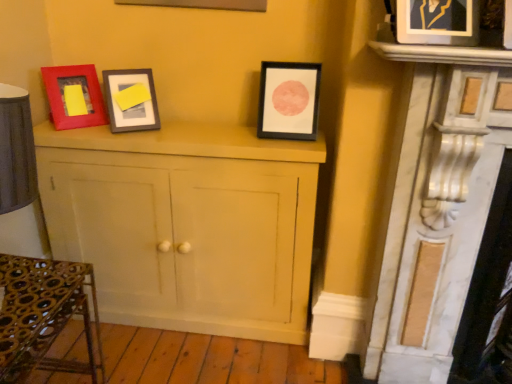
Question: From the image's perspective, is black matte picture frame at center, marked as the 2th picture frame in a front-to-back arrangement, located beneath metallic gold picture frame at upper right, positioned as the first picture frame in front-to-back order?

Choices:
 (A) no
 (B) yes

Answer: (B)

Question: Can you confirm if black matte picture frame at center, marked as the 2th picture frame in a front-to-back arrangement, is smaller than metallic gold picture frame at upper right, which ranks as the second picture frame in back-to-front order?

Choices:
 (A) no
 (B) yes

Answer: (A)

Question: Considering the relative sizes of black matte picture frame at center, marked as the 2th picture frame in a front-to-back arrangement, and metallic gold picture frame at upper right, which is the 2th picture frame from left to right, in the image provided, is black matte picture frame at center, marked as the 2th picture frame in a front-to-back arrangement, bigger than metallic gold picture frame at upper right, which is the 2th picture frame from left to right,?

Choices:
 (A) no
 (B) yes

Answer: (B)

Question: Is the position of black matte picture frame at center, the second picture frame when ordered from right to left, more distant than that of metallic gold picture frame at upper right, which is the 2th picture frame from left to right?

Choices:
 (A) yes
 (B) no

Answer: (A)

Question: Is black matte picture frame at center, arranged as the 1th picture frame when viewed from the back, wider than metallic gold picture frame at upper right, positioned as the first picture frame in front-to-back order?

Choices:
 (A) no
 (B) yes

Answer: (A)

Question: Is black matte picture frame at center, marked as the 2th picture frame in a front-to-back arrangement, to the right of metallic gold picture frame at upper right, which ranks as the second picture frame in back-to-front order, from the viewer's perspective?

Choices:
 (A) no
 (B) yes

Answer: (A)

Question: Is matte white cabinet at center aimed at metallic gold picture frame at upper right, the 1th picture frame positioned from the right?

Choices:
 (A) no
 (B) yes

Answer: (A)

Question: Considering the relative sizes of matte white cabinet at center and metallic gold picture frame at upper right, positioned as the first picture frame in front-to-back order, in the image provided, is matte white cabinet at center thinner than metallic gold picture frame at upper right, positioned as the first picture frame in front-to-back order,?

Choices:
 (A) no
 (B) yes

Answer: (A)

Question: Can you confirm if matte white cabinet at center is shorter than metallic gold picture frame at upper right, positioned as the first picture frame in front-to-back order?

Choices:
 (A) no
 (B) yes

Answer: (A)

Question: From a real-world perspective, is matte white cabinet at center on metallic gold picture frame at upper right, positioned as the first picture frame in front-to-back order?

Choices:
 (A) yes
 (B) no

Answer: (B)

Question: Does matte white cabinet at center lie in front of metallic gold picture frame at upper right, positioned as the first picture frame in front-to-back order?

Choices:
 (A) yes
 (B) no

Answer: (B)

Question: Would you consider matte white cabinet at center to be distant from metallic gold picture frame at upper right, the 1th picture frame positioned from the right?

Choices:
 (A) yes
 (B) no

Answer: (A)

Question: Can you confirm if black matte picture frame at center, marked as the 2th picture frame in a front-to-back arrangement, is positioned to the left of matte white cabinet at center?

Choices:
 (A) no
 (B) yes

Answer: (A)